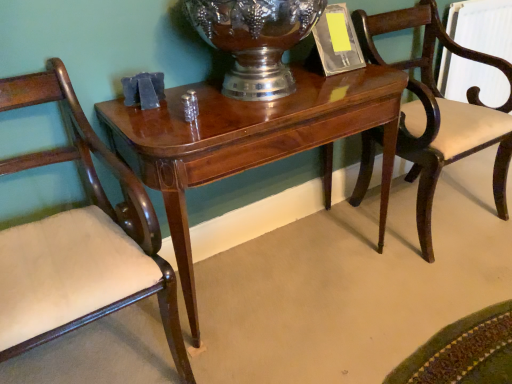
Where is `vacant area located to the right-hand side of shiny wood table at center`? The width and height of the screenshot is (512, 384). vacant area located to the right-hand side of shiny wood table at center is located at coordinates (419, 296).